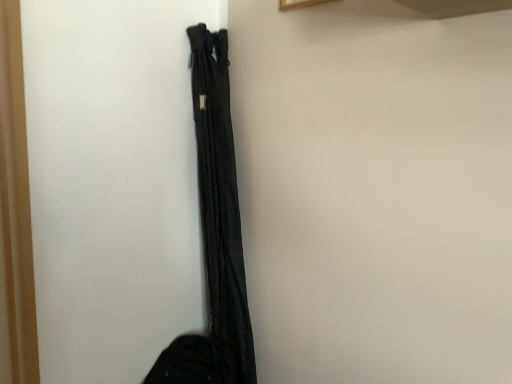
Question: Is black fabric bag at upper right positioned far away from black fabric curtain at center?

Choices:
 (A) yes
 (B) no

Answer: (B)

Question: Considering the relative sizes of black fabric bag at upper right and black fabric curtain at center in the image provided, is black fabric bag at upper right smaller than black fabric curtain at center?

Choices:
 (A) no
 (B) yes

Answer: (A)

Question: Would you say black fabric curtain at center is part of black fabric bag at upper right's contents?

Choices:
 (A) yes
 (B) no

Answer: (B)

Question: From the image's perspective, does black fabric bag at upper right appear lower than black fabric curtain at center?

Choices:
 (A) yes
 (B) no

Answer: (B)

Question: Is black fabric bag at upper right next to black fabric curtain at center and touching it?

Choices:
 (A) no
 (B) yes

Answer: (A)

Question: Can you confirm if black fabric bag at upper right is shorter than black fabric curtain at center?

Choices:
 (A) no
 (B) yes

Answer: (B)

Question: Considering the relative sizes of black fabric curtain at center and black fabric bag at upper right in the image provided, is black fabric curtain at center shorter than black fabric bag at upper right?

Choices:
 (A) yes
 (B) no

Answer: (B)

Question: Is black fabric curtain at center further to the viewer compared to black fabric bag at upper right?

Choices:
 (A) yes
 (B) no

Answer: (A)

Question: Does black fabric curtain at center have a greater height compared to black fabric bag at upper right?

Choices:
 (A) yes
 (B) no

Answer: (A)

Question: Can you confirm if black fabric curtain at center is bigger than black fabric bag at upper right?

Choices:
 (A) yes
 (B) no

Answer: (B)

Question: From a real-world perspective, is black fabric curtain at center positioned under black fabric bag at upper right based on gravity?

Choices:
 (A) yes
 (B) no

Answer: (A)

Question: Considering the relative sizes of black fabric curtain at center and black fabric bag at upper right in the image provided, is black fabric curtain at center wider than black fabric bag at upper right?

Choices:
 (A) no
 (B) yes

Answer: (A)

Question: From the image's perspective, is black fabric bag at upper right located above or below black fabric curtain at center?

Choices:
 (A) below
 (B) above

Answer: (B)